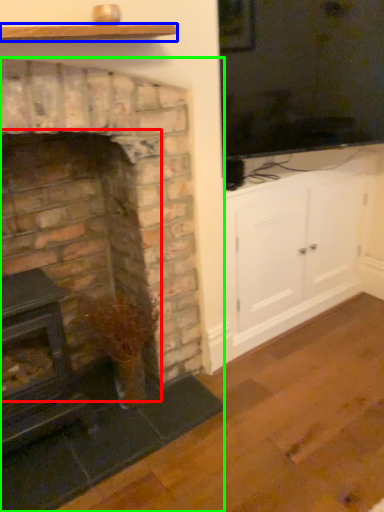
Question: Which is farther away from fireplace (highlighted by a red box)? shelf (highlighted by a blue box) or fireplace (highlighted by a green box)?

Choices:
 (A) shelf
 (B) fireplace

Answer: (A)